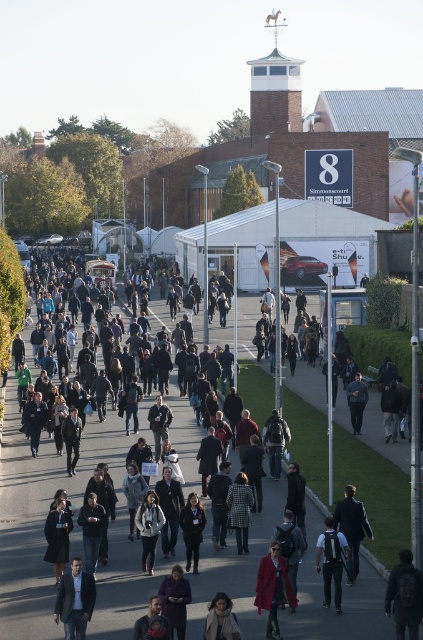
Question: Does dark gray backpack at lower right appear on the left side of matte red coat at center?

Choices:
 (A) yes
 (B) no

Answer: (B)

Question: In this image, where is dark gray coat at center located relative to dark gray coat at lower left?

Choices:
 (A) above
 (B) below

Answer: (A)

Question: Which of these objects is positioned farthest from the matte red coat at center?

Choices:
 (A) concrete pavement at center
 (B) dark gray fabric jacket at center

Answer: (A)

Question: Which point is farther to the camera?

Choices:
 (A) (123, 532)
 (B) (47, 547)

Answer: (A)

Question: From the image, what is the correct spatial relationship of light brown leather jacket at lower center in relation to dark gray jacket at center?

Choices:
 (A) below
 (B) above

Answer: (A)

Question: Based on their relative distances, which object is nearer to the light brown leather jacket at lower center?

Choices:
 (A) matte red coat at center
 (B) dark gray backpack at lower right

Answer: (A)